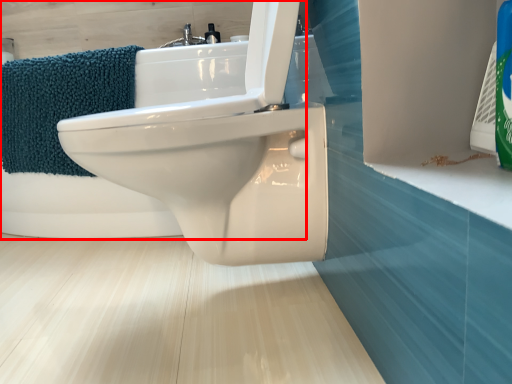
Question: From the image's perspective, where is bath (annotated by the red box) located in relation to bath towel in the image?

Choices:
 (A) above
 (B) below

Answer: (A)